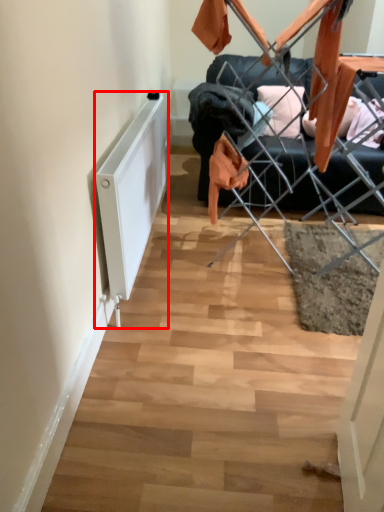
Question: From the image's perspective, where is radiator (annotated by the red box) located relative to furniture?

Choices:
 (A) above
 (B) below

Answer: (B)